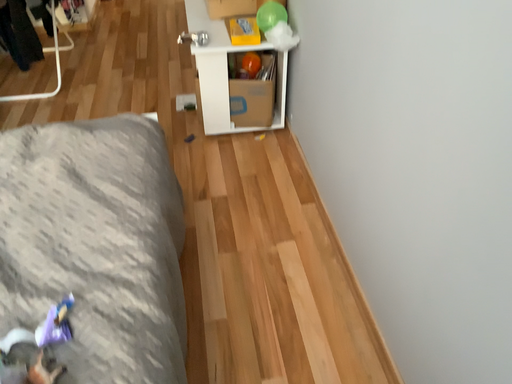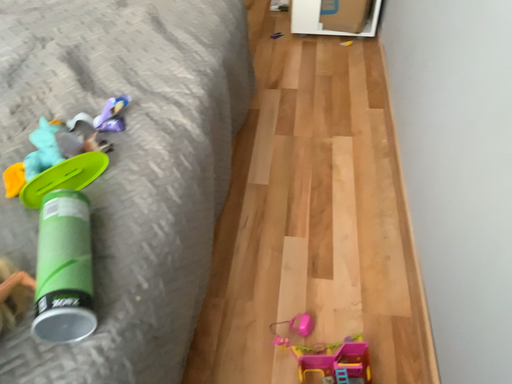
Question: Which way did the camera rotate in the video?

Choices:
 (A) rotated right
 (B) rotated left

Answer: (B)